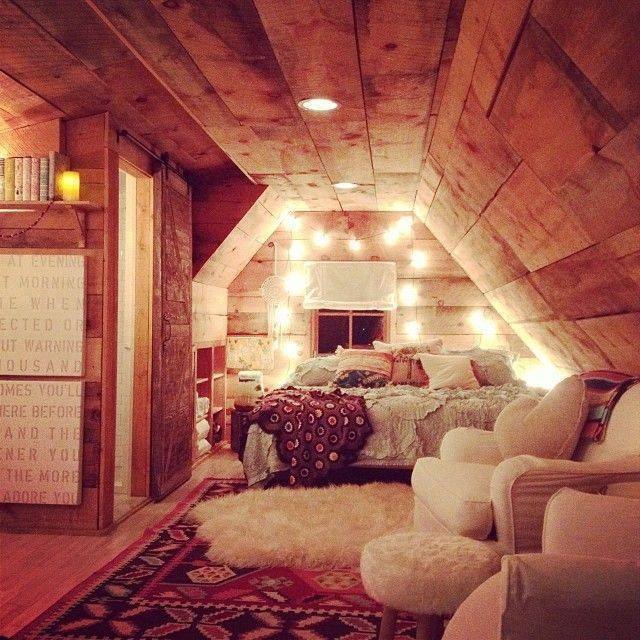
Where is `door frame`? The height and width of the screenshot is (640, 640). door frame is located at coordinates (140, 422), (109, 431).